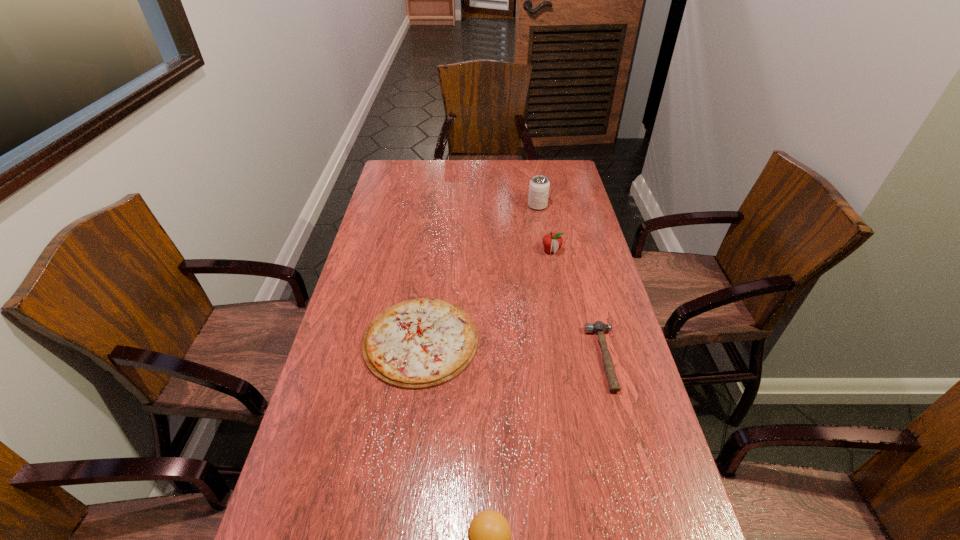
Locate an element on the screen. Image resolution: width=960 pixels, height=540 pixels. vacant area situated 0.400m on the striking face of the rightmost object is located at coordinates (447, 358).

This screenshot has width=960, height=540. I want to click on free spot located 0.180m on the right of the pizza, so click(x=540, y=340).

At what (x,y) coordinates should I click in order to perform the action: click on object present at the left edge. Please return your answer as a coordinate pair (x, y). This screenshot has height=540, width=960. Looking at the image, I should click on coord(420,343).

Locate an element on the screen. Image resolution: width=960 pixels, height=540 pixels. soda can that is at the right edge is located at coordinates (539, 185).

I want to click on apple situated at the right edge, so click(x=552, y=242).

Identify the location of hammer present at the right edge. (598, 327).

In the image, there is a desktop. Where is `free space at the left edge`? The width and height of the screenshot is (960, 540). free space at the left edge is located at coordinates (337, 474).

The image size is (960, 540). In order to click on vacant space at the right edge of the desktop in this screenshot , I will do `click(635, 394)`.

Where is `free space at the far left corner`? This screenshot has width=960, height=540. free space at the far left corner is located at coordinates (413, 173).

This screenshot has width=960, height=540. What are the coordinates of `vacant space at the far right corner` in the screenshot? It's located at (540, 164).